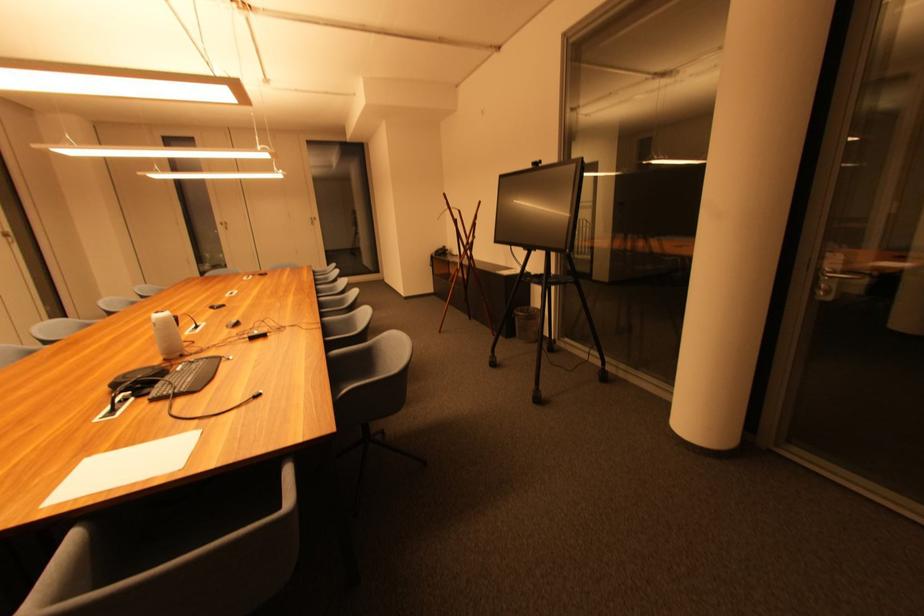
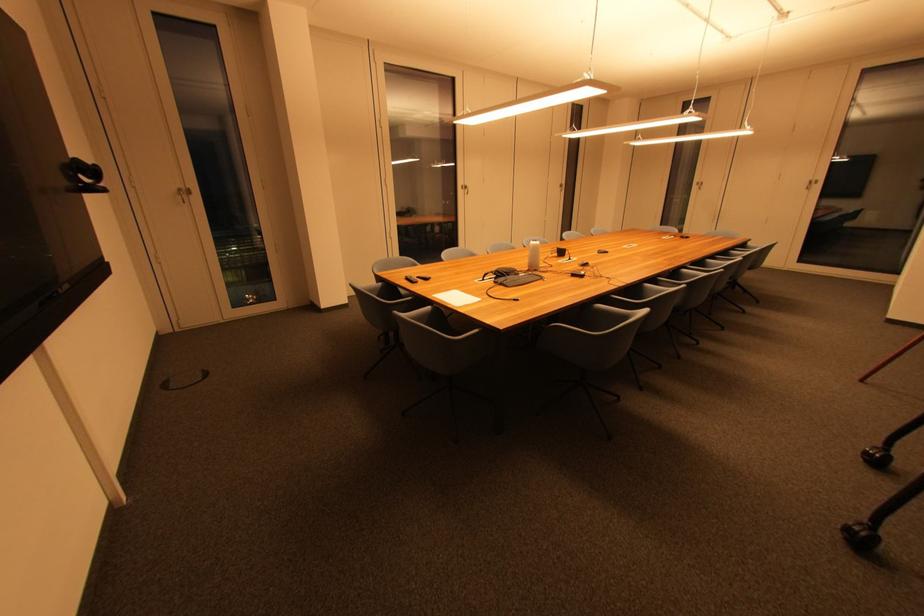
In the second image, find the point that corresponds to point (160, 318) in the first image.

(538, 244)